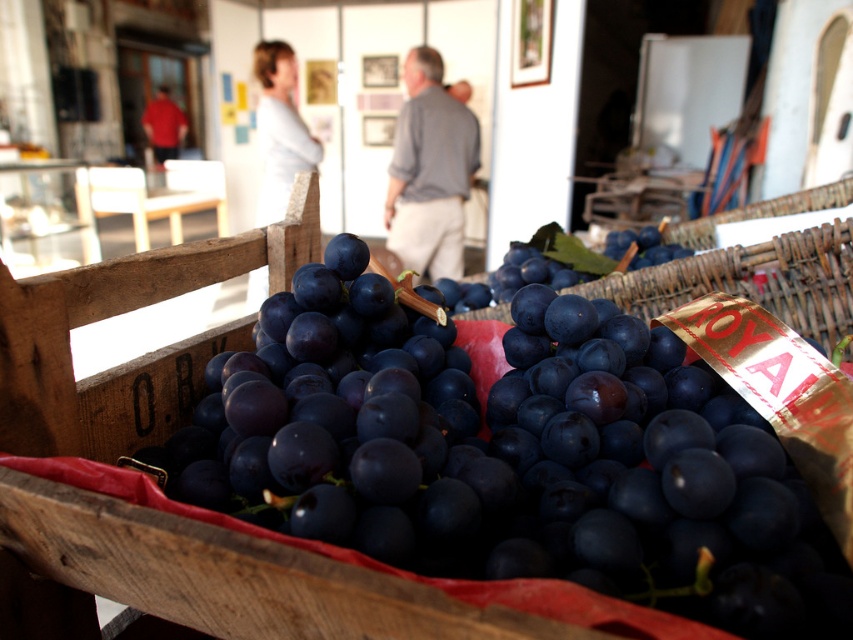
In the scene shown: You are a customer at the market and want to pick a bunch of grapes from the shiny dark purple grapes at center. If your hand is 12 inches long, can you reach the grapes from your current position?

The shiny dark purple grapes at center and viewer are 11.77 inches apart. Since your hand is 12 inches long, you can reach the grapes from your current position.